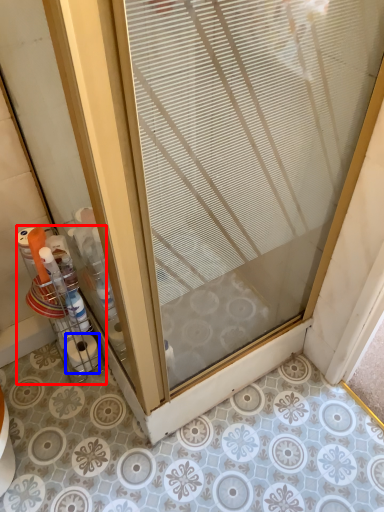
Question: Which point is further to the camera, glass box (highlighted by a red box) or toilet paper (highlighted by a blue box)?

Choices:
 (A) glass box
 (B) toilet paper

Answer: (B)